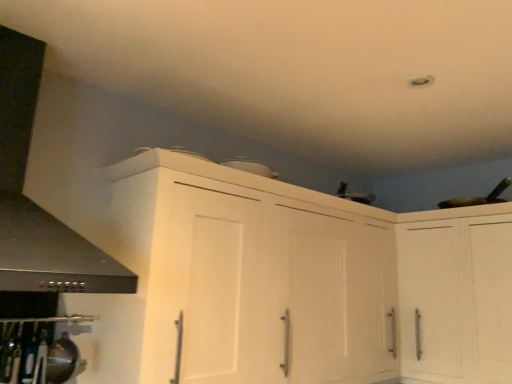
Question: Considering the relative sizes of white matte cabinet at upper right, which ranks as the second cabinetry in left-to-right order, and white matte cabinet at upper center, the first cabinetry in the left-to-right sequence, in the image provided, is white matte cabinet at upper right, which ranks as the second cabinetry in left-to-right order, thinner than white matte cabinet at upper center, the first cabinetry in the left-to-right sequence,?

Choices:
 (A) no
 (B) yes

Answer: (A)

Question: Can you confirm if white matte cabinet at upper right, which ranks as the second cabinetry in left-to-right order, is positioned to the right of white matte cabinet at upper center, which ranks as the 2th cabinetry in right-to-left order?

Choices:
 (A) no
 (B) yes

Answer: (B)

Question: Considering the relative positions of white matte cabinet at upper right, which ranks as the second cabinetry in left-to-right order, and white matte cabinet at upper center, which ranks as the 2th cabinetry in right-to-left order, in the image provided, is white matte cabinet at upper right, which ranks as the second cabinetry in left-to-right order, to the left of white matte cabinet at upper center, which ranks as the 2th cabinetry in right-to-left order, from the viewer's perspective?

Choices:
 (A) yes
 (B) no

Answer: (B)

Question: Can white matte cabinet at upper center, the first cabinetry in the left-to-right sequence, be found inside white matte cabinet at upper right, which ranks as the second cabinetry in left-to-right order?

Choices:
 (A) no
 (B) yes

Answer: (A)

Question: From the image's perspective, is white matte cabinet at upper right, which ranks as the second cabinetry in left-to-right order, beneath white matte cabinet at upper center, the first cabinetry in the left-to-right sequence?

Choices:
 (A) no
 (B) yes

Answer: (B)

Question: In terms of width, does white matte cabinet at upper center, which ranks as the 2th cabinetry in right-to-left order, look wider or thinner when compared to black matte exhaust hood at left?

Choices:
 (A) wide
 (B) thin

Answer: (B)

Question: From their relative heights in the image, would you say white matte cabinet at upper center, the first cabinetry in the left-to-right sequence, is taller or shorter than black matte exhaust hood at left?

Choices:
 (A) short
 (B) tall

Answer: (B)

Question: In terms of size, does white matte cabinet at upper center, which ranks as the 2th cabinetry in right-to-left order, appear bigger or smaller than black matte exhaust hood at left?

Choices:
 (A) small
 (B) big

Answer: (B)

Question: Is white matte cabinet at upper center, the first cabinetry in the left-to-right sequence, in front of or behind black matte exhaust hood at left in the image?

Choices:
 (A) front
 (B) behind

Answer: (B)

Question: Relative to white matte cabinet at upper right, which ranks as the second cabinetry in left-to-right order, is white matte cabinet at upper center, which ranks as the 2th cabinetry in right-to-left order, in front or behind?

Choices:
 (A) behind
 (B) front

Answer: (B)

Question: Which is correct: white matte cabinet at upper center, which ranks as the 2th cabinetry in right-to-left order, is inside white matte cabinet at upper right, which ranks as the second cabinetry in left-to-right order, or outside of it?

Choices:
 (A) inside
 (B) outside

Answer: (B)

Question: Considering the positions of point (158, 221) and point (403, 240), is point (158, 221) closer or farther from the camera than point (403, 240)?

Choices:
 (A) farther
 (B) closer

Answer: (B)

Question: Considering the positions of white matte cabinet at upper center, which ranks as the 2th cabinetry in right-to-left order, and white matte cabinet at upper right, the 1th cabinetry positioned from the right, in the image, is white matte cabinet at upper center, which ranks as the 2th cabinetry in right-to-left order, bigger or smaller than white matte cabinet at upper right, the 1th cabinetry positioned from the right,?

Choices:
 (A) big
 (B) small

Answer: (A)

Question: Relative to white matte cabinet at upper right, the 1th cabinetry positioned from the right, is black matte exhaust hood at left in front or behind?

Choices:
 (A) behind
 (B) front

Answer: (B)

Question: From a real-world perspective, relative to white matte cabinet at upper right, the 1th cabinetry positioned from the right, is black matte exhaust hood at left vertically above or below?

Choices:
 (A) below
 (B) above

Answer: (B)